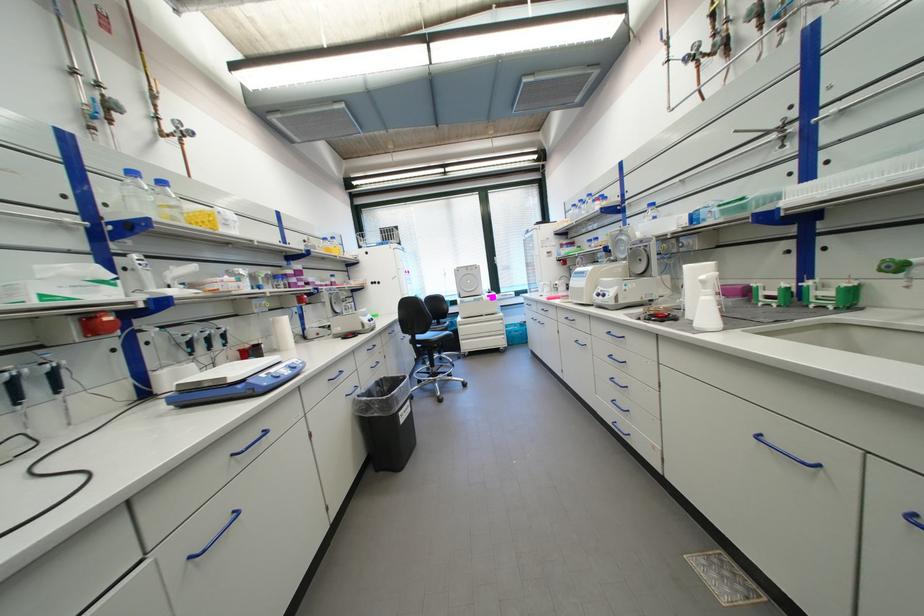
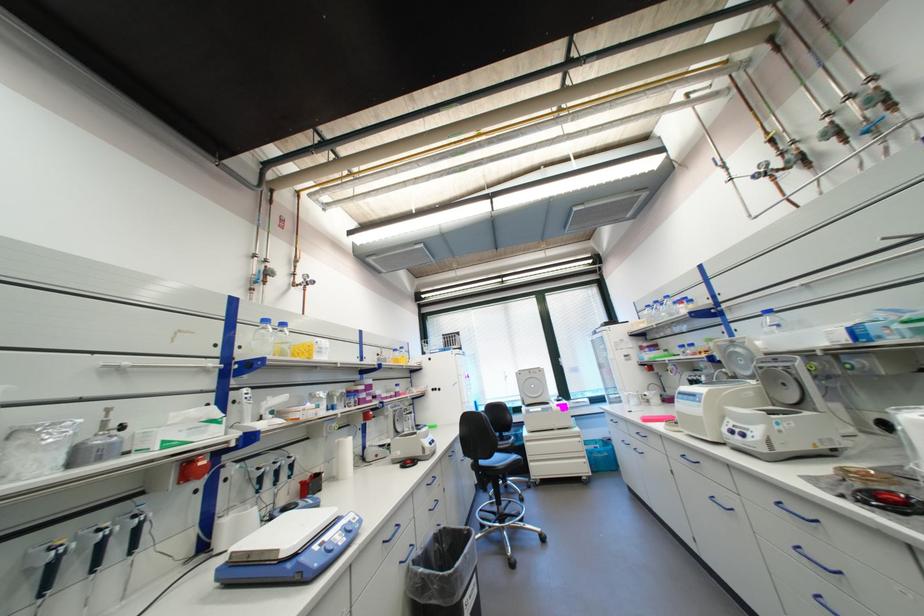
Find the pixel in the second image that matches (156,180) in the first image.

(283, 323)